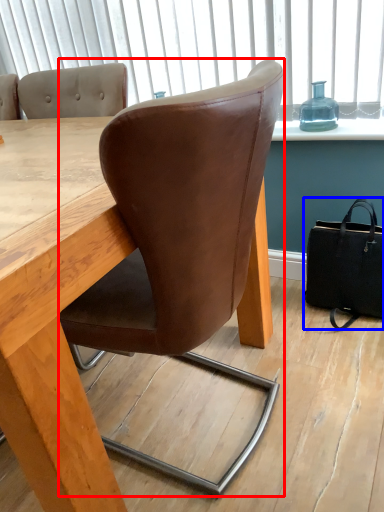
Question: Which point is closer to the camera, chair (highlighted by a red box) or handbag (highlighted by a blue box)?

Choices:
 (A) chair
 (B) handbag

Answer: (A)